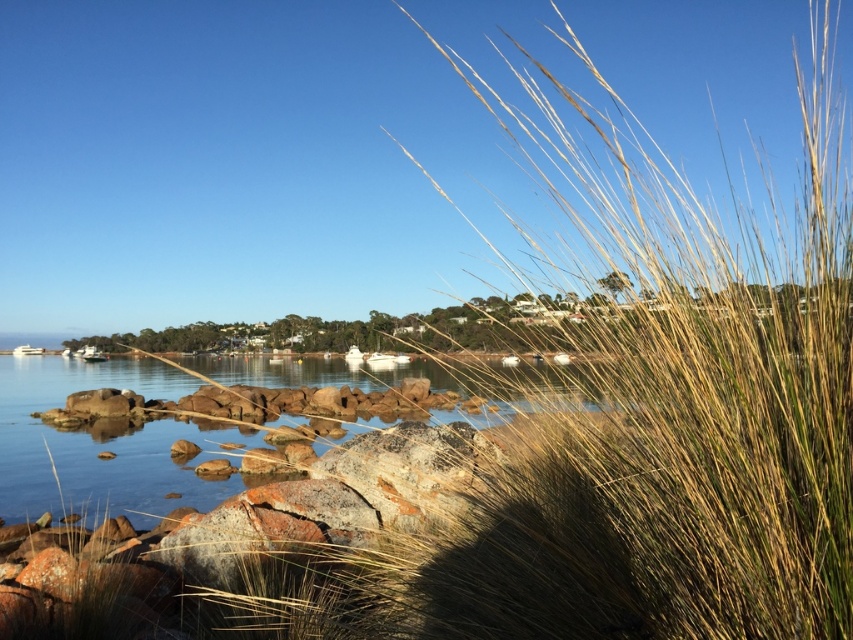
Between point (613, 477) and point (367, 324), which one is positioned behind?

Point (367, 324)

Which of these two, dry grass at center or golden grass at center, stands shorter?

dry grass at center is shorter.

Where is `dry grass at center`? Image resolution: width=853 pixels, height=640 pixels. dry grass at center is located at coordinates (682, 420).